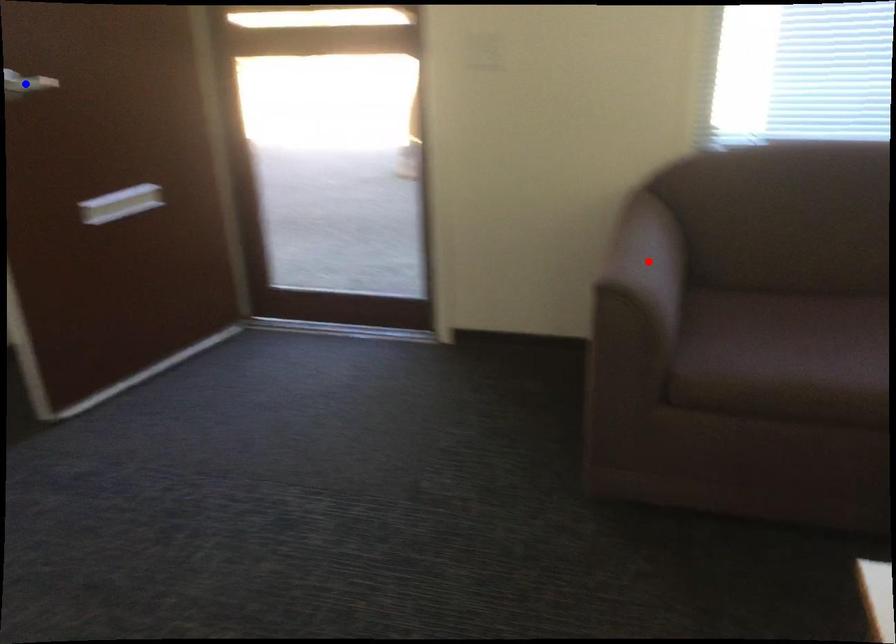
Question: Two points are marked on the image. Which point is closer to the camera?

Choices:
 (A) Blue point is closer.
 (B) Red point is closer.

Answer: (B)